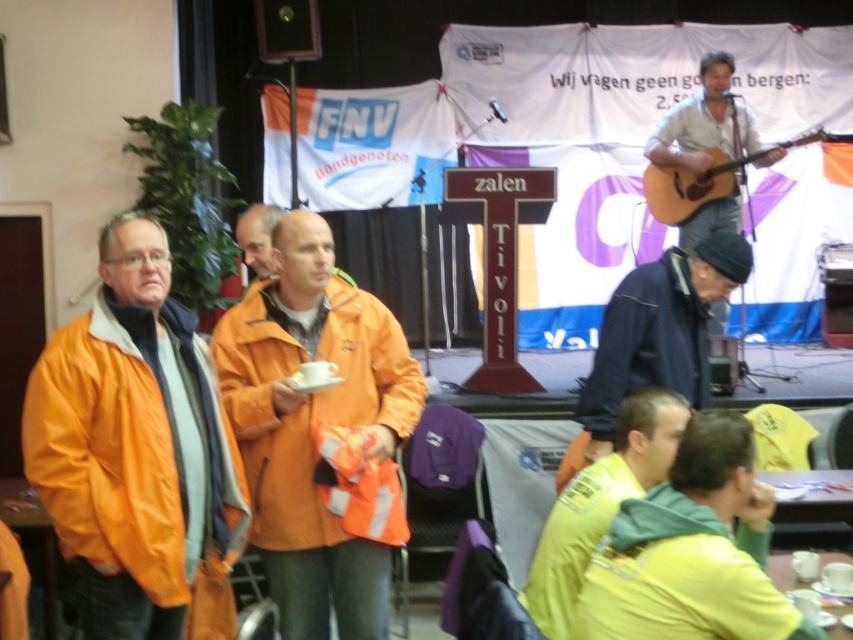
Question: Is yellow fleece jacket at lower right above dark blue jacket at lower right?

Choices:
 (A) yes
 (B) no

Answer: (B)

Question: Which point appears farthest from the camera in this image?

Choices:
 (A) (740, 147)
 (B) (50, 492)
 (C) (370, 340)

Answer: (A)

Question: Among these objects, which one is nearest to the camera?

Choices:
 (A) acoustic wood guitar at upper right
 (B) yellow fabric at lower right

Answer: (B)

Question: Does yellow fleece jacket at lower right appear on the left side of acoustic wood guitar at upper right?

Choices:
 (A) yes
 (B) no

Answer: (A)

Question: Which point appears closest to the camera in this image?

Choices:
 (A) (711, 170)
 (B) (730, 204)
 (C) (100, 467)

Answer: (C)

Question: Does yellow fabric at lower right lie behind acoustic wood guitar at upper right?

Choices:
 (A) no
 (B) yes

Answer: (A)